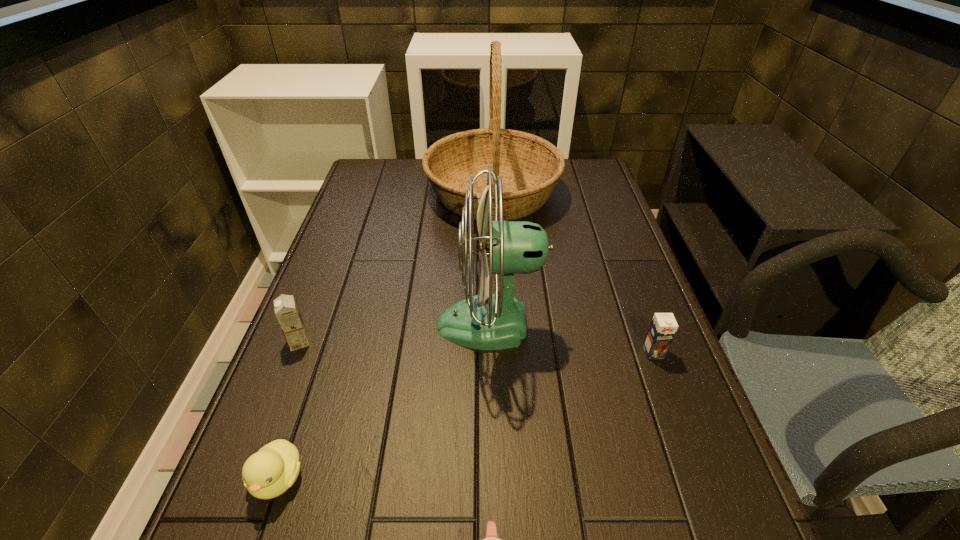
The image size is (960, 540). Identify the location of vacant area in the image that satisfies the following two spatial constraints: 1. on the back side of the left chocolate milk; 2. on the right side of the farthest object. (357, 193).

In order to click on vacant space that satisfies the following two spatial constraints: 1. in front of the fan, directing airflow; 2. on the front side of the left chocolate milk in this screenshot , I will do `click(491, 342)`.